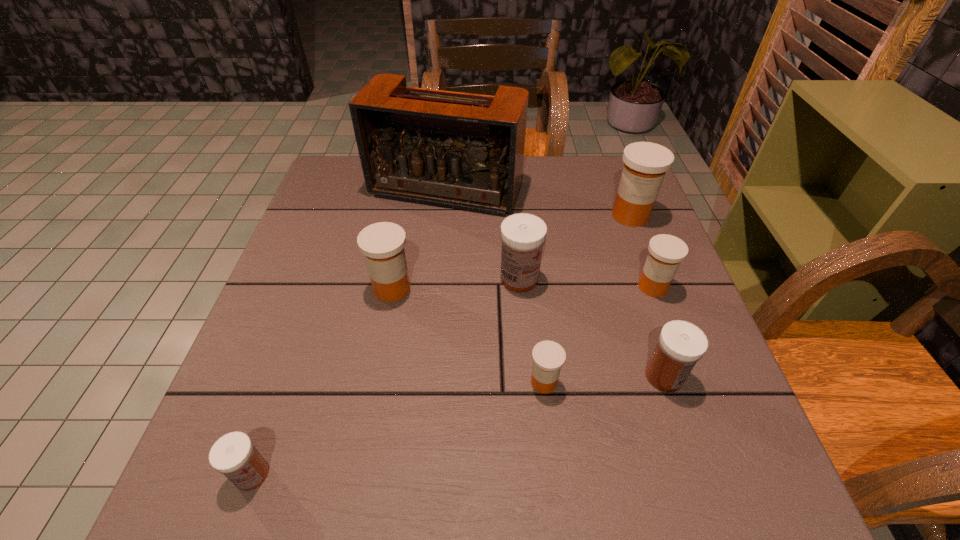
The image size is (960, 540). Find the location of `the nearest orange medicine`. the nearest orange medicine is located at coordinates (548, 357).

At what (x,y) coordinates should I click in order to perform the action: click on the second orange medicine from left to right. Please return your answer as a coordinate pair (x, y). Looking at the image, I should click on (548, 357).

This screenshot has width=960, height=540. Find the location of `the nearest medicine`. the nearest medicine is located at coordinates (234, 455).

The width and height of the screenshot is (960, 540). I want to click on the leftmost object, so click(x=234, y=455).

At what (x,y) coordinates should I click in order to perform the action: click on free space located on the right of the tallest object. Please return your answer as a coordinate pair (x, y). This screenshot has height=540, width=960. Looking at the image, I should click on (558, 190).

Locate an element on the screen. free spot located 0.310m on the label of the farthest orange medicine is located at coordinates (673, 327).

Where is `vacant region located on the left of the biggest white medicine`? This screenshot has height=540, width=960. vacant region located on the left of the biggest white medicine is located at coordinates (348, 279).

Locate an element on the screen. The image size is (960, 540). blank area located on the label of the leftmost orange medicine is located at coordinates (513, 288).

At what (x,y) coordinates should I click in order to perform the action: click on free location located 0.300m on the label of the second smallest orange medicine. Please return your answer as a coordinate pair (x, y). Looking at the image, I should click on (708, 434).

Find the location of a particular element. This screenshot has height=540, width=960. free point located 0.210m on the left of the second smallest white medicine is located at coordinates (531, 376).